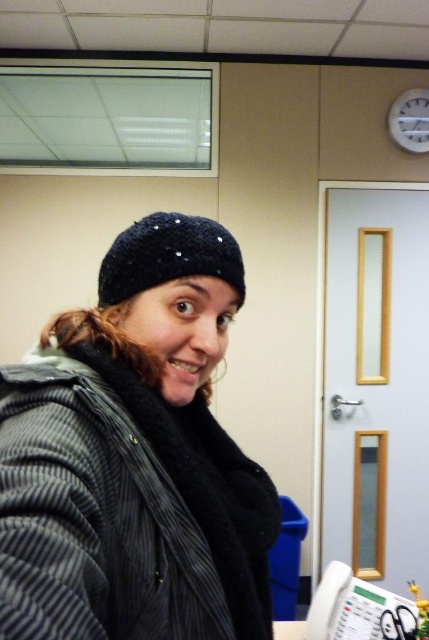
The height and width of the screenshot is (640, 429). Find the location of `striped woolen jacket at center`. striped woolen jacket at center is located at coordinates point(124,509).

Is striped woolen jacket at center smaller than white plastic clock at upper right?

No, striped woolen jacket at center is not smaller than white plastic clock at upper right.

Can you confirm if striped woolen jacket at center is wider than white plastic clock at upper right?

Correct, the width of striped woolen jacket at center exceeds that of white plastic clock at upper right.

Locate an element on the screen. striped woolen jacket at center is located at coordinates (124, 509).

Find the location of a particular element. Image resolution: width=429 pixels, height=640 pixels. striped woolen jacket at center is located at coordinates pos(124,509).

Is point (169, 260) in front of point (395, 124)?

Yes, it is in front of point (395, 124).

Does black knitted hat at center appear over white plastic clock at upper right?

No, black knitted hat at center is not above white plastic clock at upper right.

Who is more forward, [106,259] or [401,97]?

Point [106,259] is more forward.

Locate an element on the screen. black knitted hat at center is located at coordinates (169, 257).